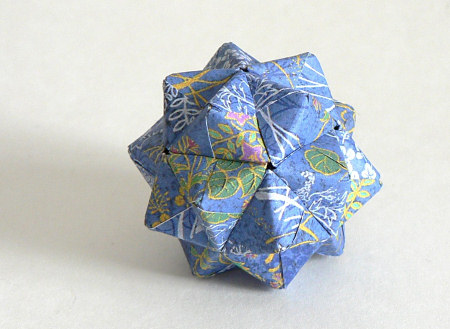
Identify the location of corner. (428, 15).